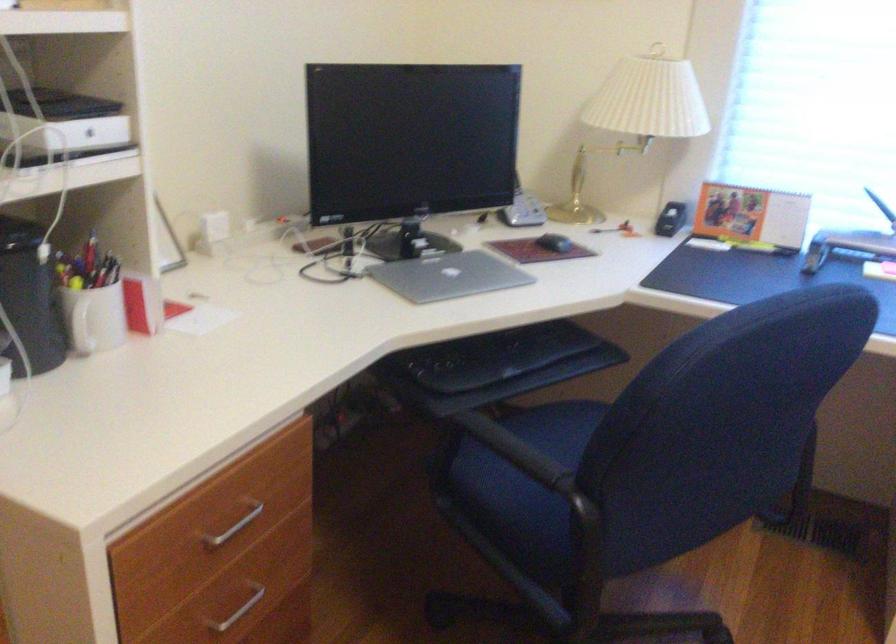
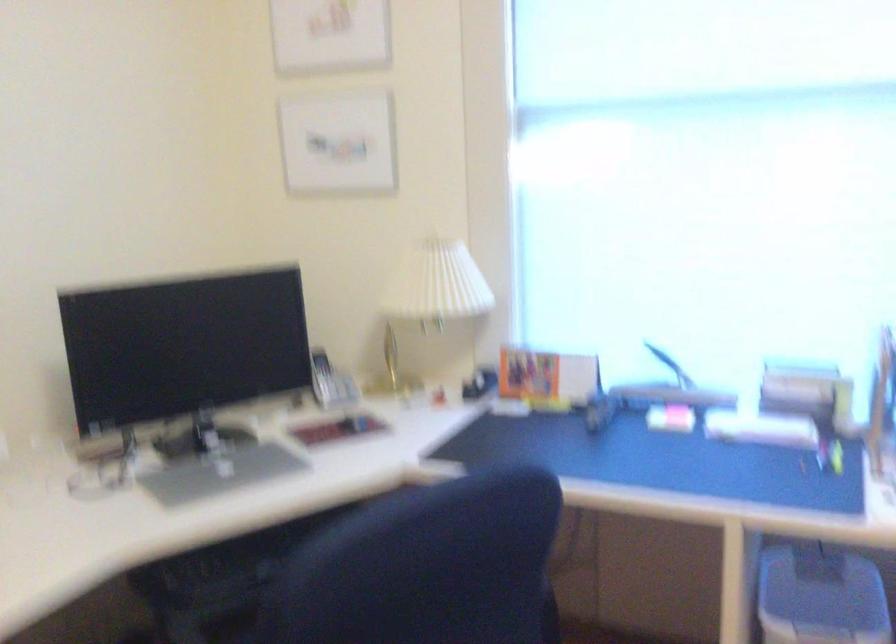
Where in the second image is the point corresponding to point (651, 116) from the first image?

(433, 295)